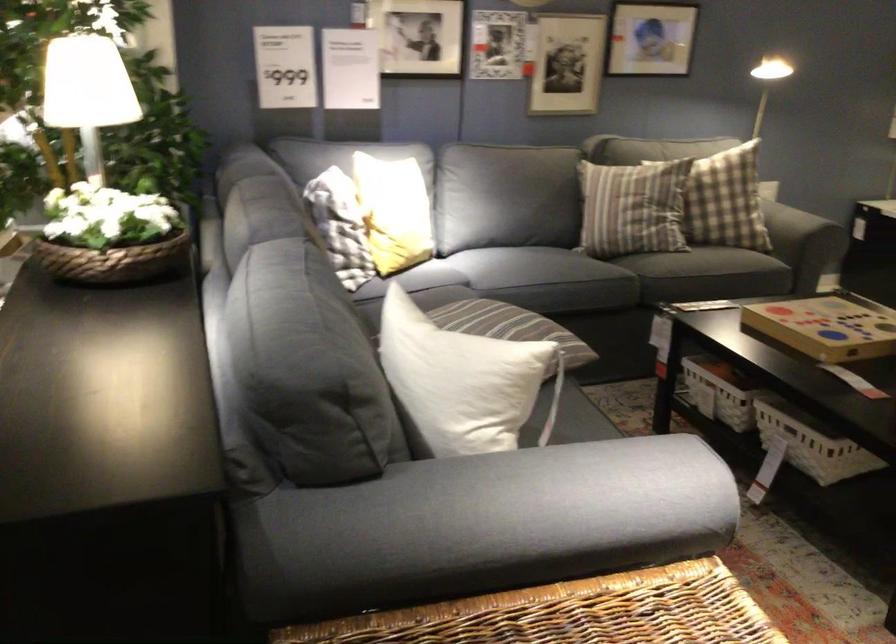
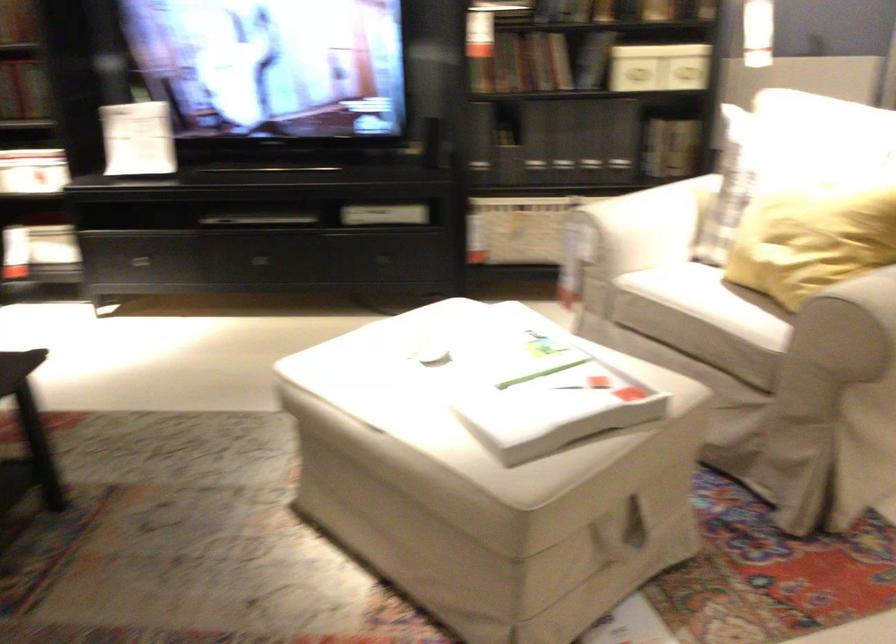
Question: The images are taken continuously from a first-person perspective. In which direction is your viewpoint rotating?

Choices:
 (A) Left
 (B) Right
 (C) Up
 (D) Down

Answer: (B)